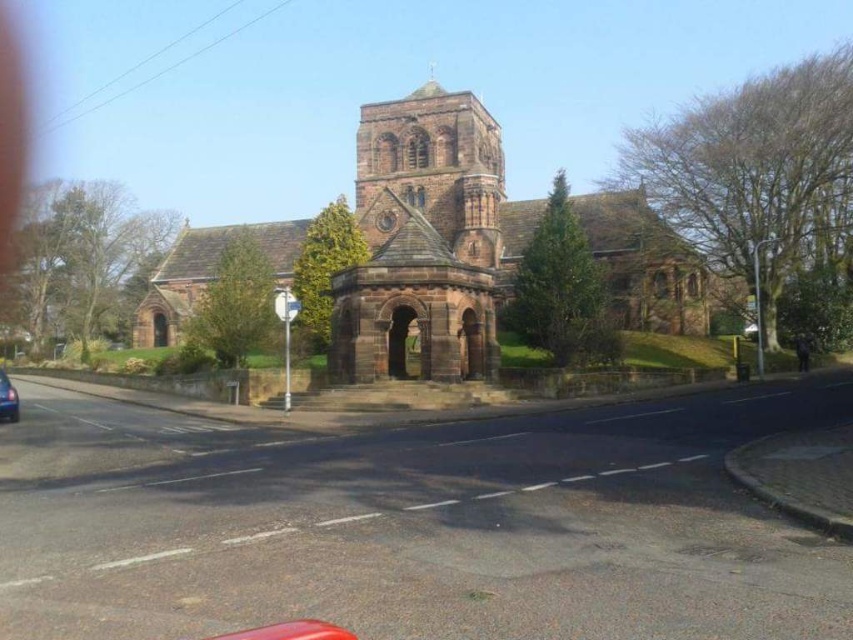
Which is in front, point (10, 416) or point (741, 328)?

Positioned in front is point (10, 416).

Between metallic silver car at lower left and metallic silver car at center, which one is positioned lower?

metallic silver car at lower left is lower down.

Is point (10, 397) more distant than point (743, 332)?

No, it is in front of (743, 332).

Identify the location of metallic silver car at lower left. Image resolution: width=853 pixels, height=640 pixels. (7, 397).

Who is lower down, brown stone church at center or metallic silver car at lower left?

metallic silver car at lower left

Can you confirm if brown stone church at center is bigger than metallic silver car at lower left?

Yes, brown stone church at center is bigger than metallic silver car at lower left.

Find the location of `brown stone church at center`. brown stone church at center is located at coordinates (436, 221).

Does brown stone church at center appear under brown stone tower at center?

Yes.

Can you confirm if brown stone church at center is positioned to the right of brown stone tower at center?

No, brown stone church at center is not to the right of brown stone tower at center.

Is point (630, 205) positioned behind point (480, 106)?

No, (630, 205) is in front of (480, 106).

Identify the location of brown stone church at center. (436, 221).